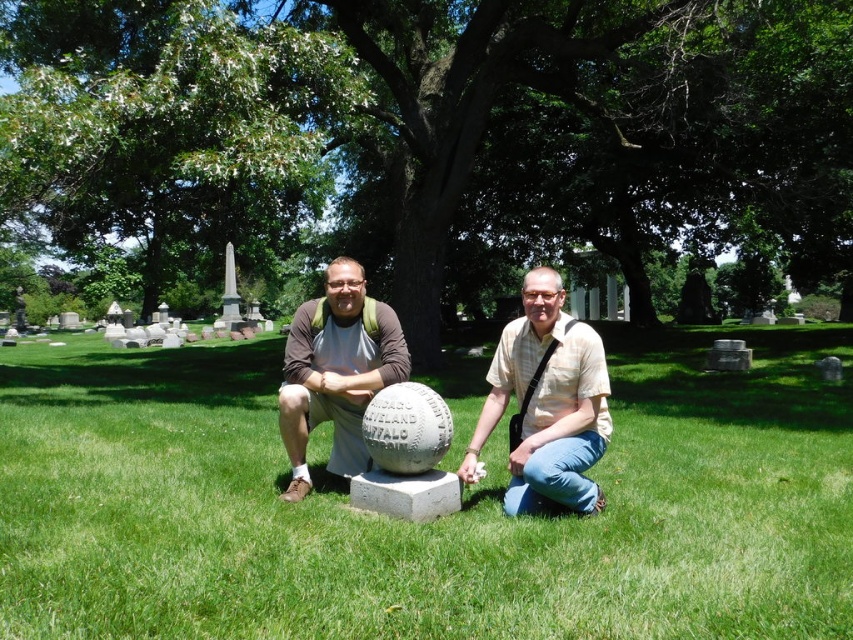
Does point (515, 460) come closer to viewer compared to point (303, 316)?

That is True.

Consider the image. Does light brown textured shirt at center have a lesser width compared to matte brown baseball at center?

No, light brown textured shirt at center is not thinner than matte brown baseball at center.

Between point (537, 288) and point (300, 445), which one is positioned in front?

Point (537, 288) is in front.

Where is `light brown textured shirt at center`? Image resolution: width=853 pixels, height=640 pixels. light brown textured shirt at center is located at coordinates (547, 403).

Measure the distance from white stone baseball at center to matte brown baseball at center.

white stone baseball at center is 1.12 meters from matte brown baseball at center.

Is white stone baseball at center behind matte brown baseball at center?

No, white stone baseball at center is in front of matte brown baseball at center.

The height and width of the screenshot is (640, 853). What do you see at coordinates (548, 403) in the screenshot?
I see `white stone baseball at center` at bounding box center [548, 403].

What are the coordinates of `white stone baseball at center` in the screenshot? It's located at (548, 403).

This screenshot has height=640, width=853. What do you see at coordinates (425, 524) in the screenshot?
I see `green grass at center` at bounding box center [425, 524].

I want to click on green grass at center, so click(x=425, y=524).

Is point (225, 500) closer to viewer compared to point (537, 406)?

Yes, it is in front of point (537, 406).

Identify the location of green grass at center. (425, 524).